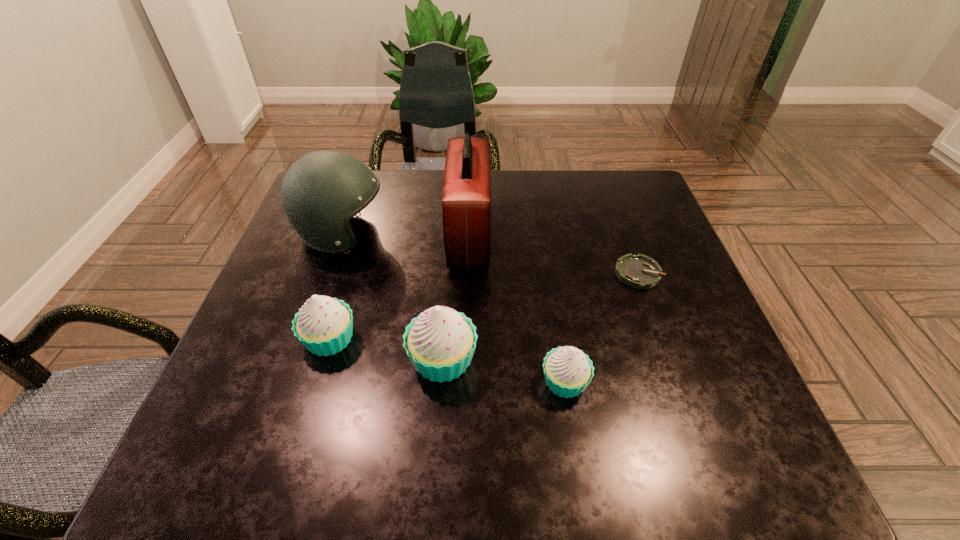
The height and width of the screenshot is (540, 960). Identify the location of cupcake that is the second closest one to the first aid kit. (324, 325).

This screenshot has height=540, width=960. In order to click on cupcake that is the second nearest to the second shortest cupcake in this screenshot , I will do [568, 371].

I want to click on free point that satisfies the following two spatial constraints: 1. at the face opening of the football helmet; 2. on the right side of the second shortest object, so [x=293, y=381].

Locate an element on the screen. vacant space that satisfies the following two spatial constraints: 1. on the side of the second object from right to left with the cross symbol; 2. on the left side of the first aid kit is located at coordinates (465, 381).

Identify the location of vacant area in the image that satisfies the following two spatial constraints: 1. on the front side of the second shortest object; 2. on the right side of the second shortest cupcake. (317, 381).

Identify the location of vacant space that satisfies the following two spatial constraints: 1. on the front side of the tallest cupcake; 2. on the left side of the rightmost cupcake. The width and height of the screenshot is (960, 540). (441, 381).

Where is `free spot that satisfies the following two spatial constraints: 1. on the front side of the fourth tallest object; 2. on the right side of the tallest cupcake`? free spot that satisfies the following two spatial constraints: 1. on the front side of the fourth tallest object; 2. on the right side of the tallest cupcake is located at coordinates (324, 359).

Identify the location of free space in the image that satisfies the following two spatial constraints: 1. on the back side of the shortest cupcake; 2. on the side of the first aid kit with the cross symbol. (542, 236).

At what (x,y) coordinates should I click in order to perform the action: click on free space that satisfies the following two spatial constraints: 1. on the back side of the rightmost object; 2. at the face opening of the football helmet. Please return your answer as a coordinate pair (x, y). This screenshot has width=960, height=540. Looking at the image, I should click on (624, 234).

Find the location of a particular element. free space that satisfies the following two spatial constraints: 1. on the side of the first aid kit with the cross symbol; 2. on the front side of the third shortest object is located at coordinates (466, 339).